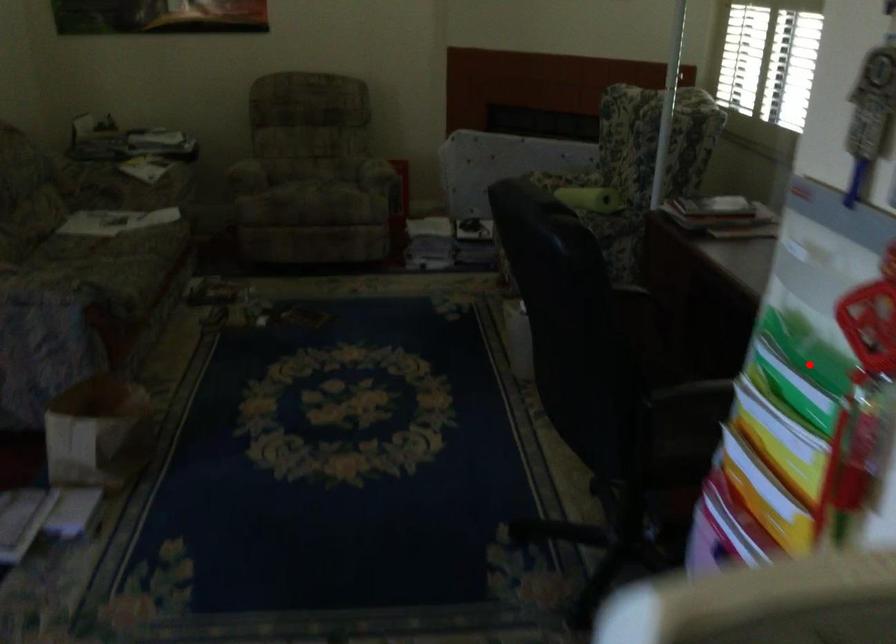
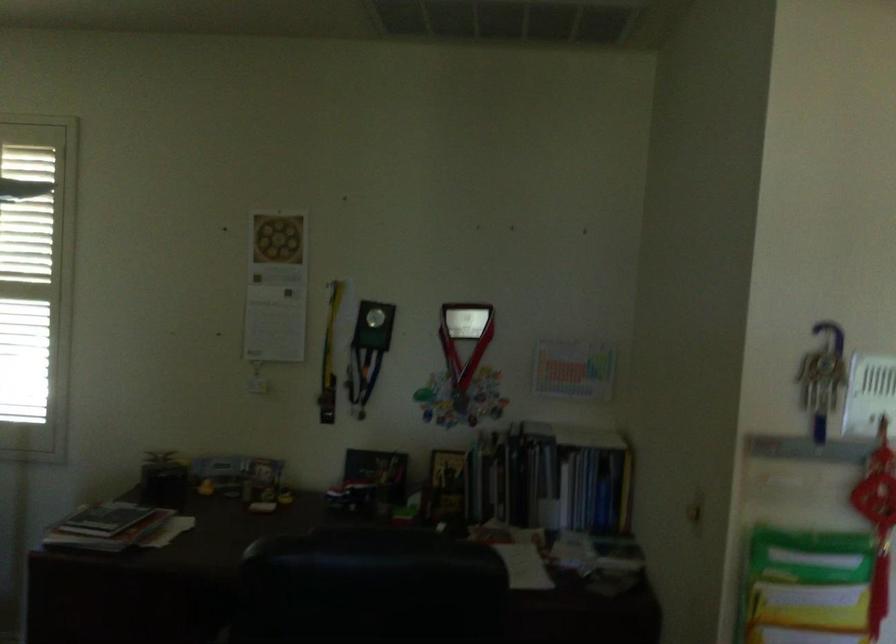
The point at the highlighted location is marked in the first image. Where is the corresponding point in the second image?

(814, 558)